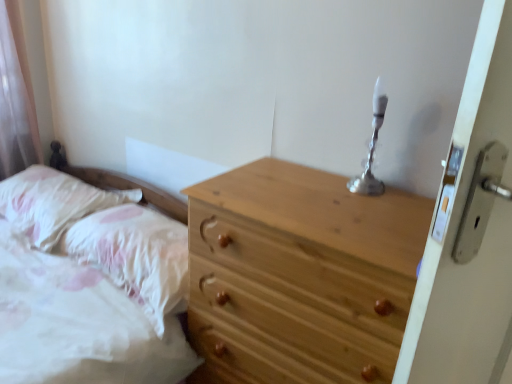
Question: Looking at their shapes, would you say natural wood chest of drawers at center is wider or thinner than white fluffy pillow at lower left, arranged as the 2th pillow when viewed from the left?

Choices:
 (A) thin
 (B) wide

Answer: (B)

Question: Is natural wood chest of drawers at center inside the boundaries of white fluffy pillow at lower left, arranged as the 2th pillow when viewed from the left, or outside?

Choices:
 (A) inside
 (B) outside

Answer: (B)

Question: Which object is positioned farthest from the natural wood chest of drawers at center?

Choices:
 (A) silver metallic candle holder at upper right
 (B) white fluffy pillow at lower left, the 1th pillow positioned from the right
 (C) fluffy white pillow at left, the first pillow from the left

Answer: (C)

Question: Which is nearer to the natural wood chest of drawers at center?

Choices:
 (A) fluffy white pillow at left, the first pillow from the left
 (B) silver metallic candle holder at upper right
 (C) white fluffy pillow at lower left, the 1th pillow positioned from the right

Answer: (B)